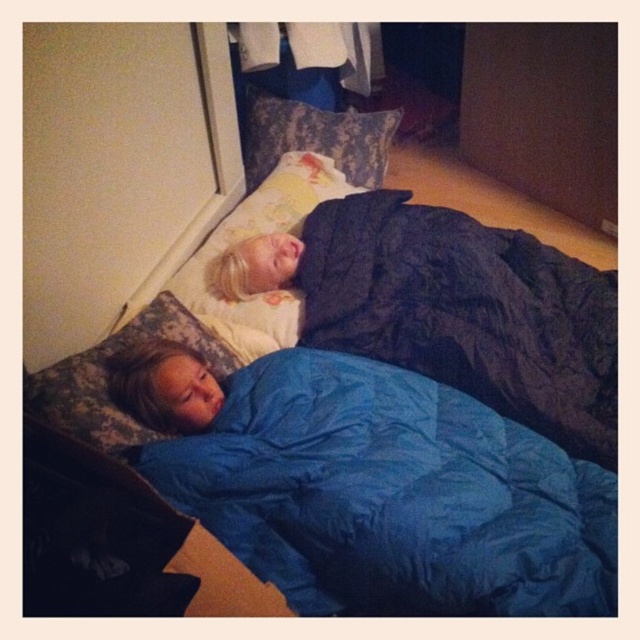
Looking at this image, does blue down-filled sleeping bag at upper center have a lesser width compared to camouflage fabric pillow at lower left?

No, blue down-filled sleeping bag at upper center is not thinner than camouflage fabric pillow at lower left.

Is blue down-filled sleeping bag at upper center closer to camera compared to camouflage fabric pillow at lower left?

No.

At what (x,y) coordinates should I click in order to perform the action: click on blue down-filled sleeping bag at upper center. Please return your answer as a coordinate pair (x, y). This screenshot has width=640, height=640. Looking at the image, I should click on (467, 310).

Is camouflage fabric pillow at lower left wider than patterned fabric pillow at upper center?

In fact, camouflage fabric pillow at lower left might be narrower than patterned fabric pillow at upper center.

Between camouflage fabric pillow at lower left and patterned fabric pillow at upper center, which one appears on the right side from the viewer's perspective?

patterned fabric pillow at upper center is more to the right.

The width and height of the screenshot is (640, 640). Describe the element at coordinates (108, 380) in the screenshot. I see `camouflage fabric pillow at lower left` at that location.

Image resolution: width=640 pixels, height=640 pixels. What are the coordinates of `camouflage fabric pillow at lower left` in the screenshot? It's located at (108, 380).

Between yellow floral pillow at upper center and patterned fabric pillow at upper center, which one appears on the left side from the viewer's perspective?

Positioned to the left is yellow floral pillow at upper center.

Can you confirm if yellow floral pillow at upper center is wider than patterned fabric pillow at upper center?

In fact, yellow floral pillow at upper center might be narrower than patterned fabric pillow at upper center.

Which is behind, point (243, 304) or point (355, 129)?

The point (355, 129) is behind.

Identify the location of yellow floral pillow at upper center. The image size is (640, 640). (259, 237).